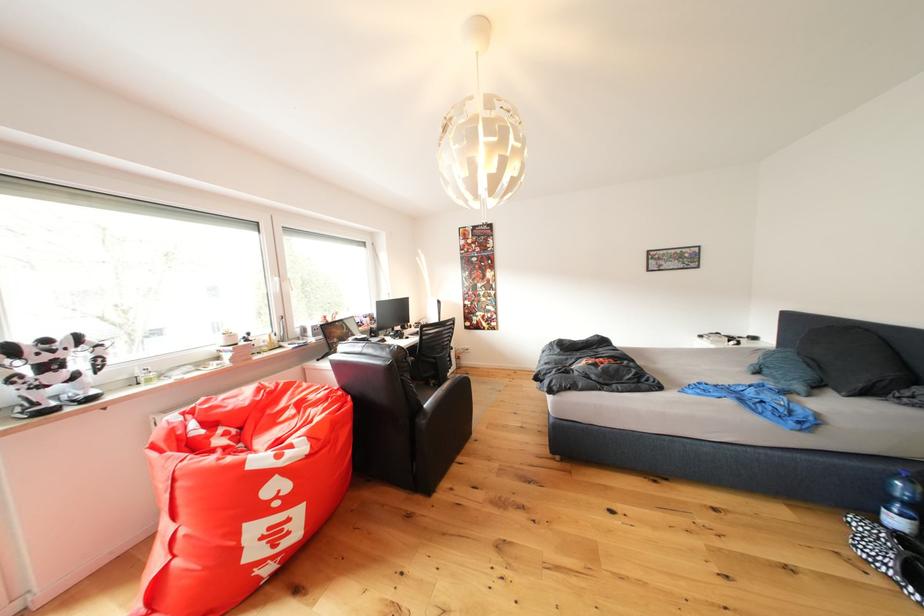
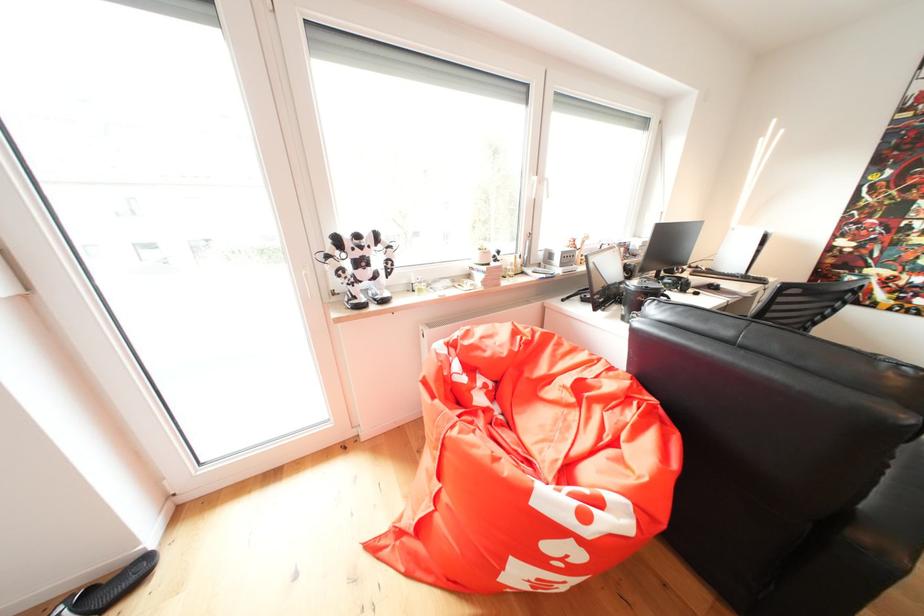
The images are taken continuously from a first-person perspective. In which direction is your viewpoint rotating?

The camera's rotation is toward left-down.